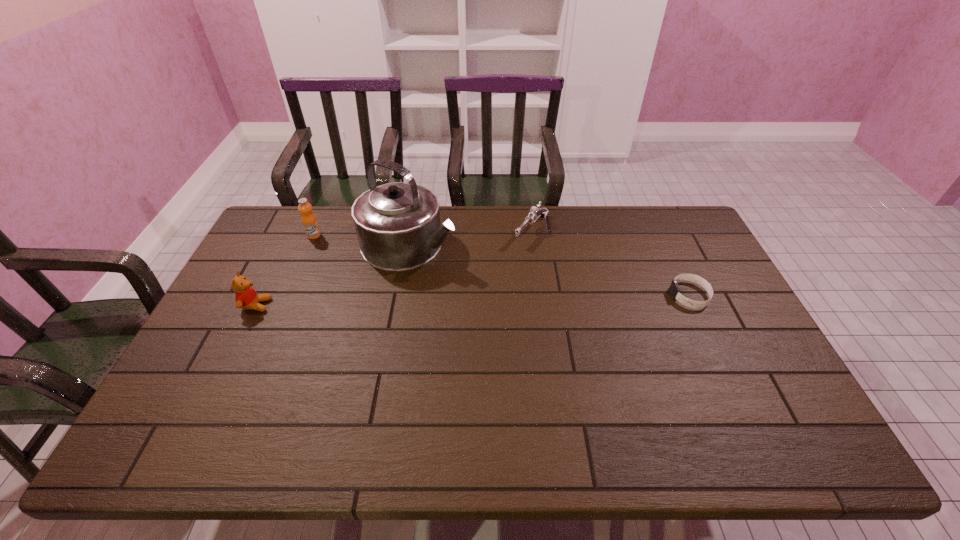
Locate an element on the screen. vacant spot on the desktop that is between the leftmost object and the shortest object and is positioned aimed along the barrel of the gun is located at coordinates (469, 300).

Where is `free space on the desktop that is between the leftmost object and the wristband and is positioned with the spout at the front of the tallest object`? The width and height of the screenshot is (960, 540). free space on the desktop that is between the leftmost object and the wristband and is positioned with the spout at the front of the tallest object is located at coordinates (536, 299).

Identify the location of vacant space on the desktop that is between the leftmost object and the rightmost object and is positioned on the front label of the second tallest object. The height and width of the screenshot is (540, 960). click(418, 301).